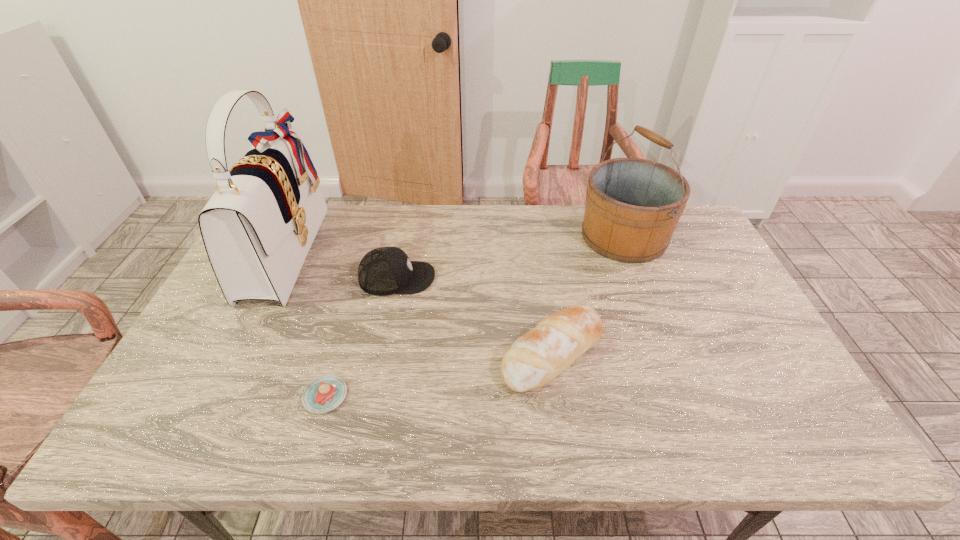
Where is `free space that satisfies the following two spatial constraints: 1. on the front-facing side of the leftmost object; 2. on the right side of the second object from right to left`? Image resolution: width=960 pixels, height=540 pixels. free space that satisfies the following two spatial constraints: 1. on the front-facing side of the leftmost object; 2. on the right side of the second object from right to left is located at coordinates (235, 353).

The image size is (960, 540). Identify the location of vacant space that satisfies the following two spatial constraints: 1. on the front-facing side of the second object from right to left; 2. on the right side of the cap. (382, 353).

Identify the location of vacant space that satisfies the following two spatial constraints: 1. on the back side of the shortest object; 2. on the right side of the rightmost object. (372, 237).

Where is `free space in the image that satisfies the following two spatial constraints: 1. on the back side of the fourth object from left to right; 2. on the front-facing side of the satchel`? This screenshot has width=960, height=540. free space in the image that satisfies the following two spatial constraints: 1. on the back side of the fourth object from left to right; 2. on the front-facing side of the satchel is located at coordinates (538, 251).

The height and width of the screenshot is (540, 960). In order to click on vacant region that satisfies the following two spatial constraints: 1. on the front-facing side of the cap; 2. on the back side of the bread in this screenshot , I will do `click(382, 353)`.

You are a GUI agent. You are given a task and a screenshot of the screen. Output one action in this format:
    pyautogui.click(x=<x>, y=<y>)
    Task: Click on the free location that satisfies the following two spatial constraints: 1. on the front-facing side of the bread; 2. on the right side of the satchel
    The width and height of the screenshot is (960, 540).
    Given the screenshot: What is the action you would take?
    pyautogui.click(x=235, y=353)